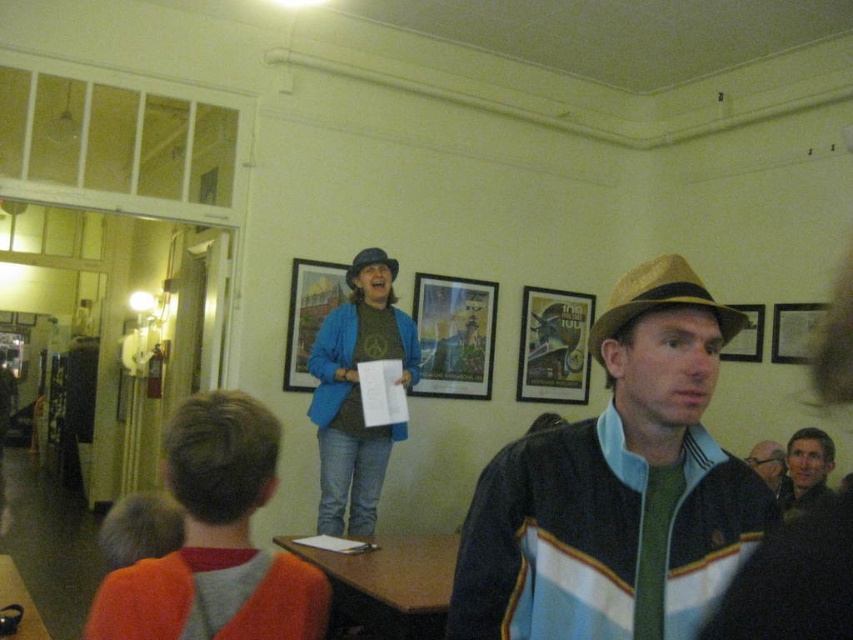
Is gold textured cowboy hat at center positioned before wooden picture frame at center?

Yes.

At what (x,y) coordinates should I click in order to perform the action: click on gold textured cowboy hat at center. Please return your answer as a coordinate pair (x, y). The width and height of the screenshot is (853, 640). Looking at the image, I should click on (659, 300).

Is metallic gold picture frame at center smaller than blue cotton jacket at upper center?

Correct, metallic gold picture frame at center occupies less space than blue cotton jacket at upper center.

What do you see at coordinates (553, 346) in the screenshot?
I see `metallic gold picture frame at center` at bounding box center [553, 346].

Identify the location of metallic gold picture frame at center. coord(553,346).

Between orange sweater at lower left and wooden framed poster at center, which one has less height?

orange sweater at lower left

Can you confirm if orange sweater at lower left is positioned to the left of wooden framed poster at center?

Incorrect, orange sweater at lower left is not on the left side of wooden framed poster at center.

Locate an element on the screen. The width and height of the screenshot is (853, 640). orange sweater at lower left is located at coordinates (215, 540).

The height and width of the screenshot is (640, 853). In order to click on orange sweater at lower left in this screenshot , I will do `click(215, 540)`.